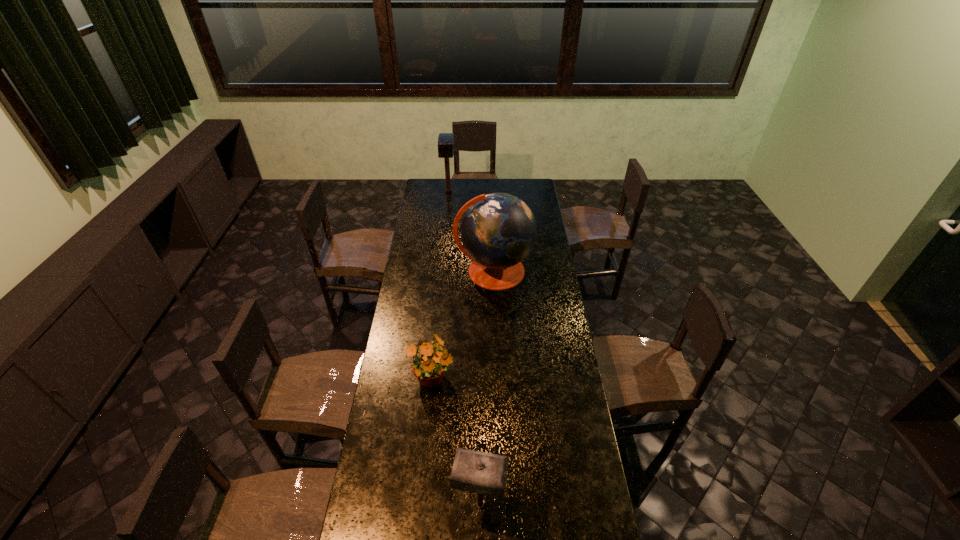
Locate an element on the screen. vacant space located 0.140m on the back of the second shortest object is located at coordinates (480, 446).

Locate an element on the screen. This screenshot has height=540, width=960. vacant space located 0.120m on the right of the shortest object is located at coordinates (487, 381).

Locate an element on the screen. object at the far edge is located at coordinates (445, 140).

Find the location of a particular element. mallet that is at the left edge is located at coordinates (445, 140).

Where is `flowerpot that is at the left edge`? The height and width of the screenshot is (540, 960). flowerpot that is at the left edge is located at coordinates (429, 365).

Where is `object present at the right edge`? This screenshot has height=540, width=960. object present at the right edge is located at coordinates (498, 230).

At what (x,y) coordinates should I click in order to perform the action: click on object located at the far left corner. Please return your answer as a coordinate pair (x, y). Image resolution: width=960 pixels, height=540 pixels. Looking at the image, I should click on (445, 140).

What are the coordinates of `vacant space at the far edge of the desktop` in the screenshot? It's located at (445, 192).

Image resolution: width=960 pixels, height=540 pixels. In order to click on free spot at the left edge of the desktop in this screenshot , I will do `click(402, 281)`.

The width and height of the screenshot is (960, 540). In the image, there is a desktop. In order to click on blank space at the right edge in this screenshot , I will do `click(569, 468)`.